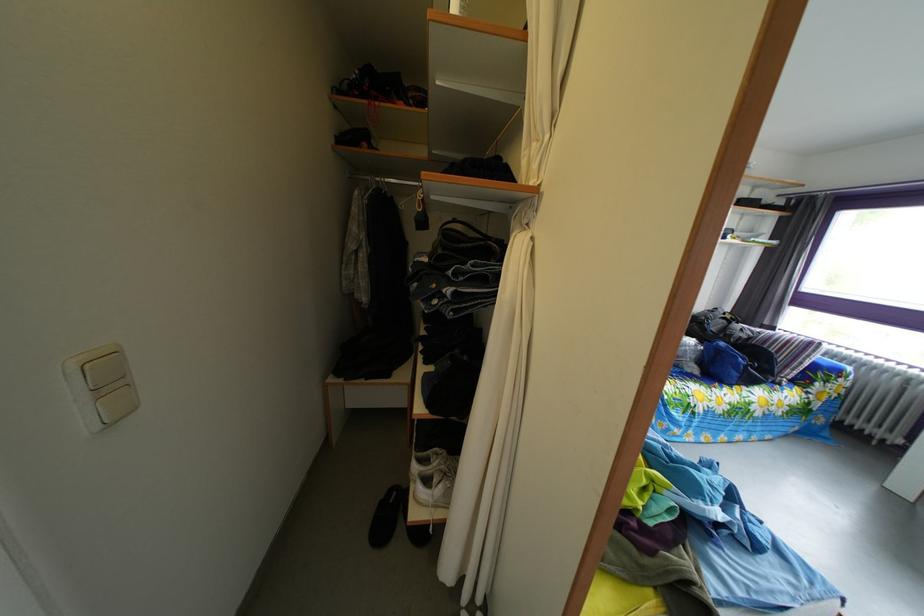
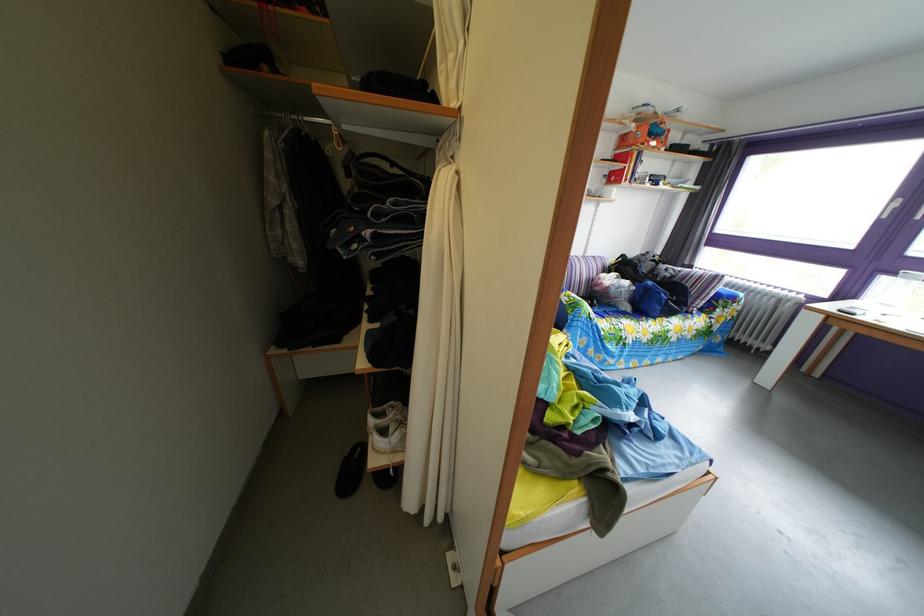
The point at (514, 270) is marked in the first image. Where is the corresponding point in the second image?

(438, 207)